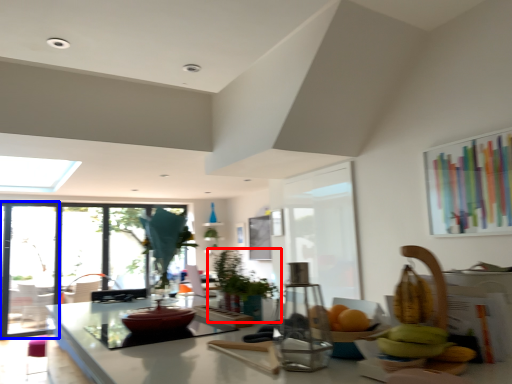
Question: Among these objects, which one is nearest to the camera, houseplant (highlighted by a red box) or screen door (highlighted by a blue box)?

Choices:
 (A) houseplant
 (B) screen door

Answer: (A)